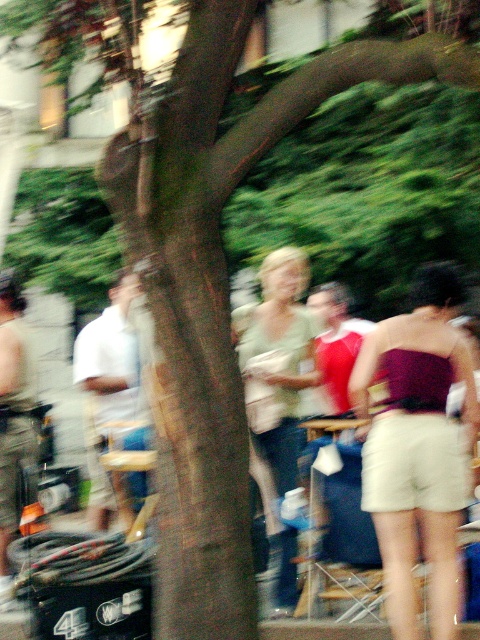
You are a photographer trying to capture a group photo. You notice two people in the crowd wearing a maroon satin strapless top at center and a matte green shirt at center. Which clothing item is wider?

The maroon satin strapless top at center is wider than the matte green shirt at center.